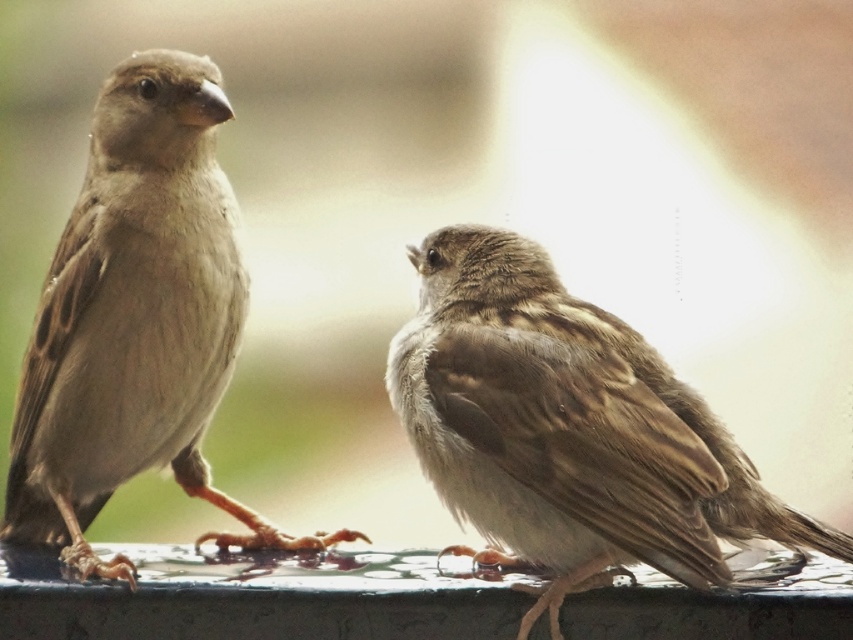
You are a photographer aiming to capture both birds in a single shot. Given their positions, can you determine if the brown feathered sparrow at center will be in the frame if you focus on the other bird?

The brown feathered sparrow at center is located at point 0.666, so it will be in the frame if you focus on the other bird.

You are a photographer trying to capture a closeup of the brown feathered sparrow at center. You notice a point marked at coordinates (x=567, y=428). Based on the scene description, where is this point located on the bird?

The point at coordinates (x=567, y=428) is located on the brown feathered sparrow at center.